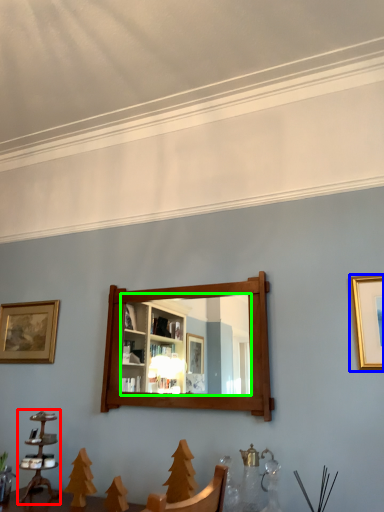
Question: Which object is the farthest from candle holder (highlighted by a red box)? Choose among these: picture frame (highlighted by a blue box) or mirror (highlighted by a green box).

Choices:
 (A) picture frame
 (B) mirror

Answer: (A)